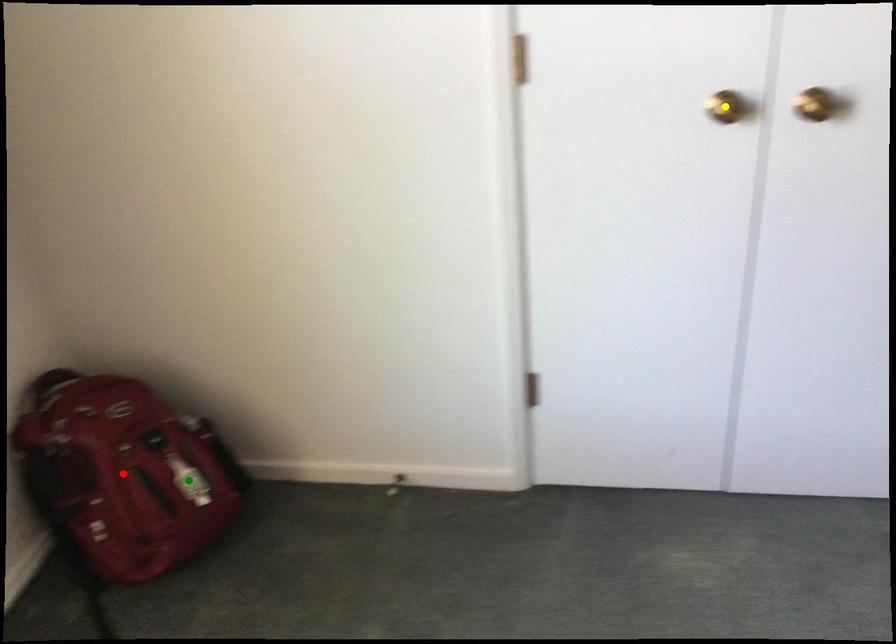
Order these from farthest to nearest:
red point | green point | yellow point

1. green point
2. red point
3. yellow point